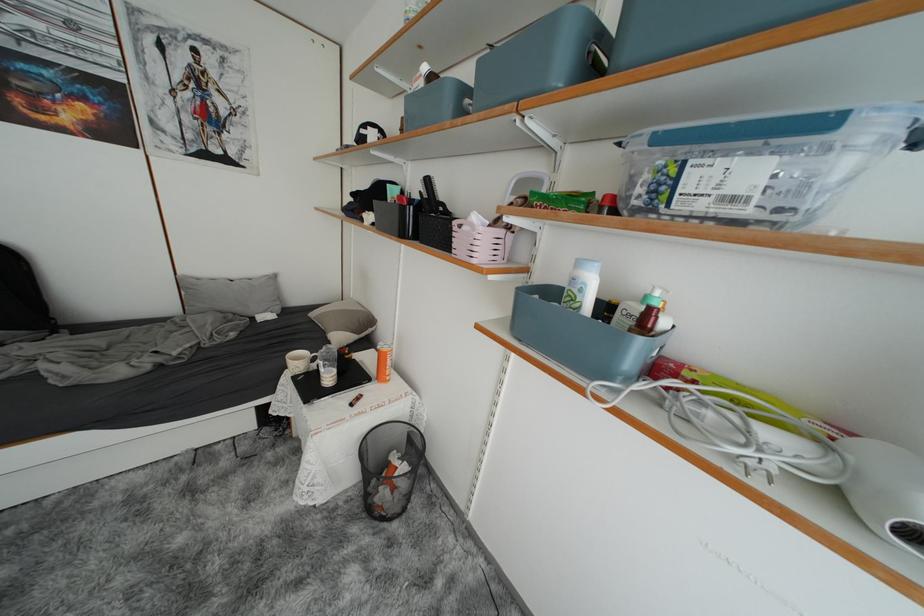
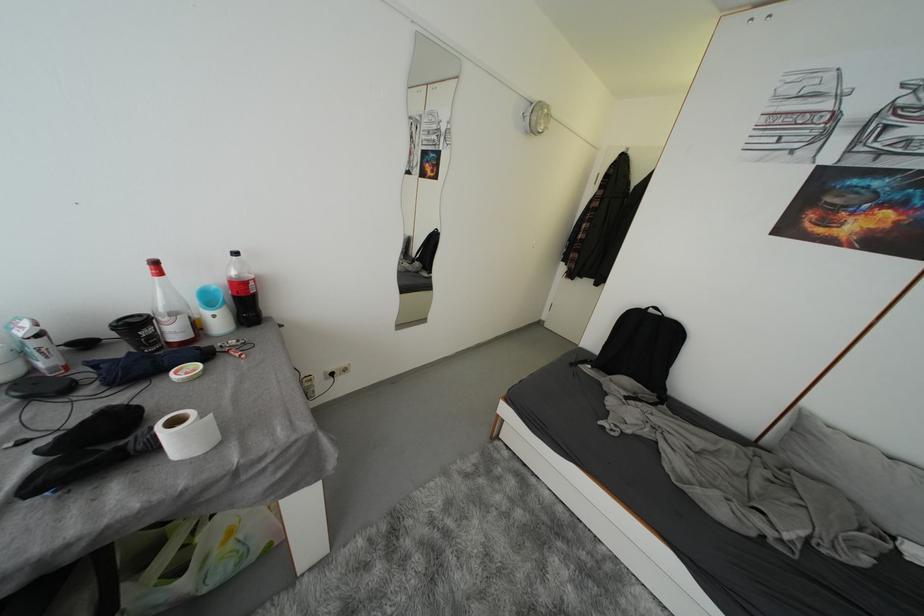
Question: The first image is from the beginning of the video and the second image is from the end. How did the camera likely rotate when shooting the video?

Choices:
 (A) Left
 (B) Right
 (C) Up
 (D) Down

Answer: (A)